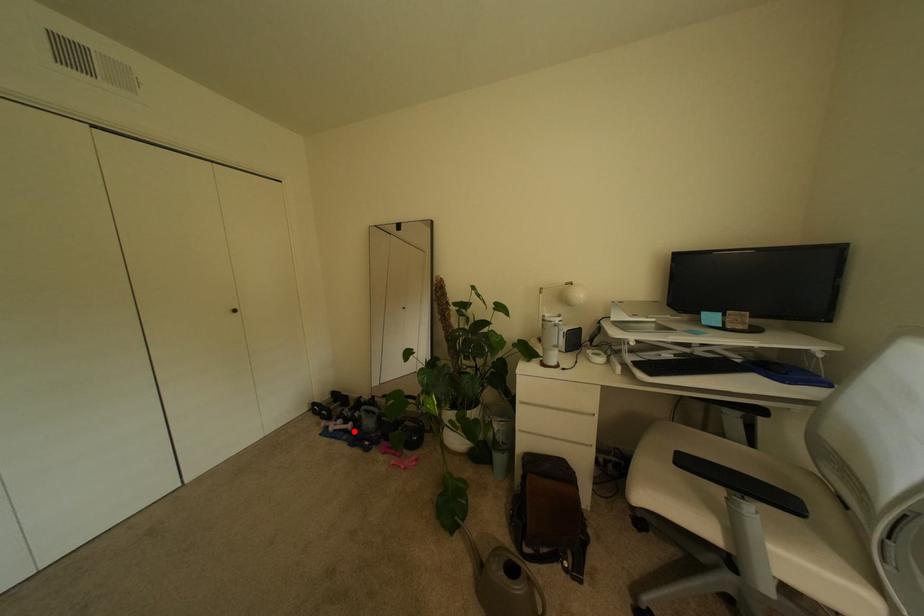
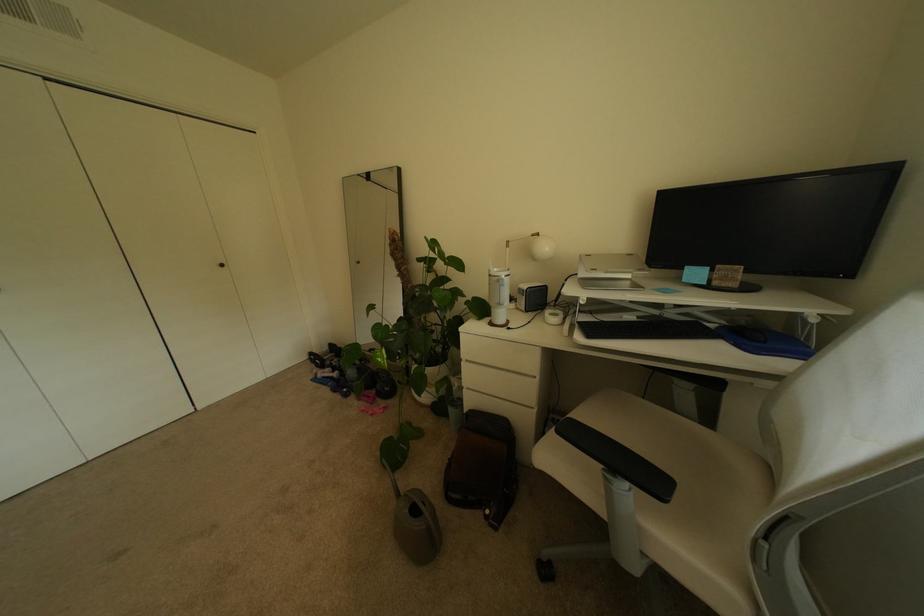
Question: A red point is marked in image1. In image2, is the corresponding 3D point closer to the camera or farther? Reply with the corresponding letter.

Choices:
 (A) The corresponding 3D point is closer.
 (B) The corresponding 3D point is farther.

Answer: (A)